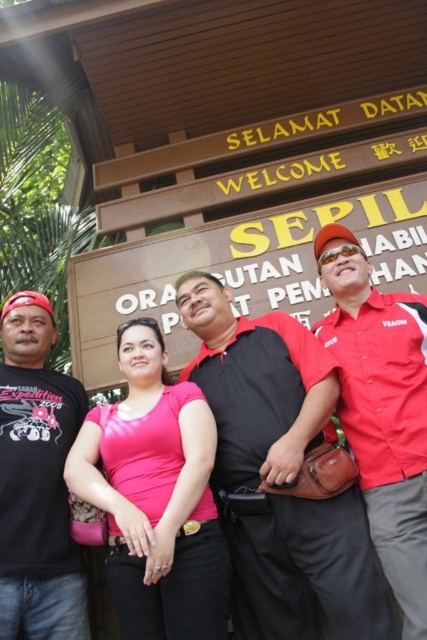
Question: Which point is closer to the camera?

Choices:
 (A) (81, 468)
 (B) (374, 260)
 (C) (242, 605)
 (D) (417, 579)

Answer: (D)

Question: Observing the image, what is the correct spatial positioning of wooden sign at center in reference to red fabric shirt at center?

Choices:
 (A) below
 (B) above

Answer: (B)

Question: From the image, what is the correct spatial relationship of black smooth shirt at center in relation to wooden sign at center?

Choices:
 (A) left
 (B) right

Answer: (A)

Question: Which point is closer to the camera taking this photo?

Choices:
 (A) (101, 298)
 (B) (117, 561)

Answer: (B)

Question: Can you confirm if black smooth shirt at center is positioned to the left of matte black t-shirt at left?

Choices:
 (A) yes
 (B) no

Answer: (B)

Question: Which object is the closest to the black smooth shirt at center?

Choices:
 (A) pink matte shirt at center
 (B) wooden sign at center
 (C) red fabric shirt at center

Answer: (A)